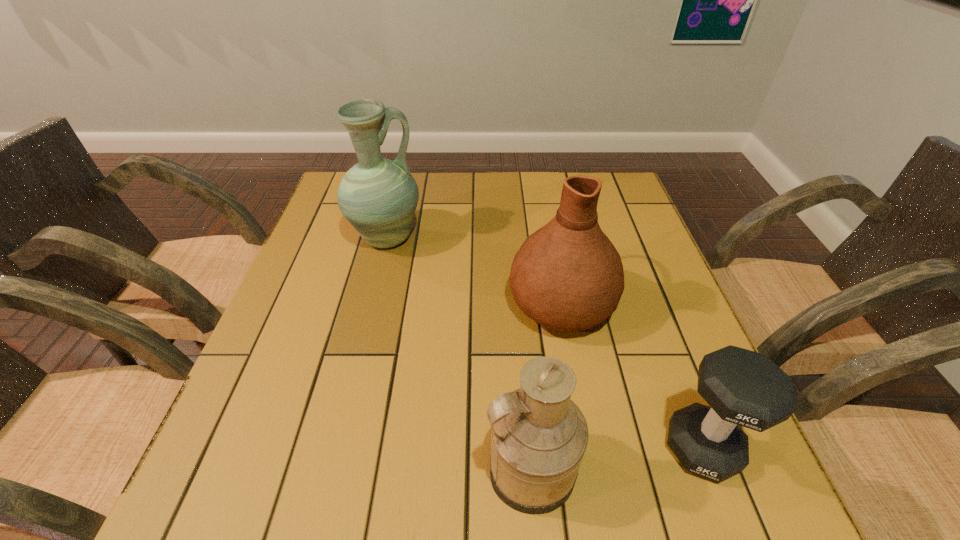
Where is `free location located 0.300m on the side of the second farthest object with the handle`? free location located 0.300m on the side of the second farthest object with the handle is located at coordinates (541, 198).

Identify the location of vacant space located on the back of the third tallest object. (519, 343).

At what (x,y) coordinates should I click in order to perform the action: click on vacant space located 0.120m on the back of the dumbbell. Please return your answer as a coordinate pair (x, y). This screenshot has width=960, height=540. Looking at the image, I should click on (668, 359).

Locate an element on the screen. The width and height of the screenshot is (960, 540). pitcher that is at the near edge is located at coordinates (539, 436).

Identify the location of dumbbell present at the near edge. (746, 388).

In order to click on object that is positioned at the left edge in this screenshot , I will do [378, 196].

Where is `pitcher positioned at the right edge`? This screenshot has height=540, width=960. pitcher positioned at the right edge is located at coordinates (568, 276).

At what (x,y) coordinates should I click in order to perform the action: click on dumbbell at the right edge. Please return your answer as a coordinate pair (x, y). Image resolution: width=960 pixels, height=540 pixels. Looking at the image, I should click on (746, 388).

Where is `object situated at the near right corner`? The width and height of the screenshot is (960, 540). object situated at the near right corner is located at coordinates (746, 388).

Locate an element on the screen. vacant space at the far edge of the desktop is located at coordinates (492, 215).